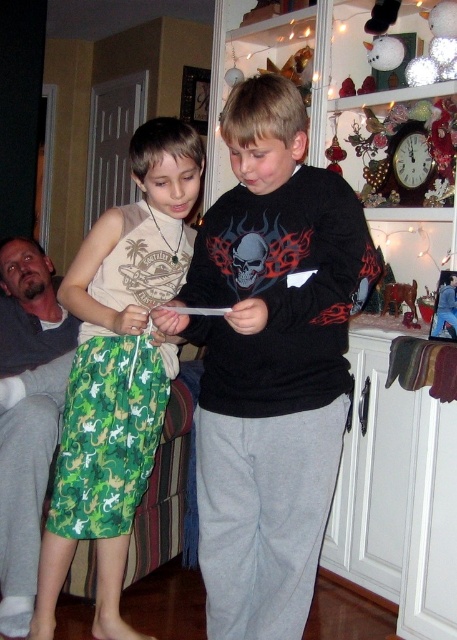
Is black matte sweatshirt at center further to the viewer compared to gray fabric pants at lower left?

No, black matte sweatshirt at center is in front of gray fabric pants at lower left.

Describe the element at coordinates (270, 364) in the screenshot. I see `black matte sweatshirt at center` at that location.

At what (x,y) coordinates should I click in order to perform the action: click on black matte sweatshirt at center. Please return your answer as a coordinate pair (x, y). This screenshot has width=457, height=640. Looking at the image, I should click on (270, 364).

Does point (258, 566) come in front of point (144, 282)?

That is True.

Between black matte sweatshirt at center and green camouflage shorts at left, which one has more height?

green camouflage shorts at left

The height and width of the screenshot is (640, 457). Describe the element at coordinates (270, 364) in the screenshot. I see `black matte sweatshirt at center` at that location.

At what (x,y) coordinates should I click in order to perform the action: click on black matte sweatshirt at center. Please return your answer as a coordinate pair (x, y). This screenshot has width=457, height=640. Looking at the image, I should click on (270, 364).

In the scene shown: Which of these two, green camouflage shorts at left or gray fabric pants at lower left, stands shorter?

Standing shorter between the two is gray fabric pants at lower left.

Who is more forward, [121,470] or [31,483]?

Point [121,470] is in front.

You are a GUI agent. You are given a task and a screenshot of the screen. Output one action in this format:
    pyautogui.click(x=<x>, y=<y>)
    Task: Click on the green camouflage shorts at left
    The width and height of the screenshot is (457, 640).
    Given the screenshot: What is the action you would take?
    pyautogui.click(x=118, y=371)